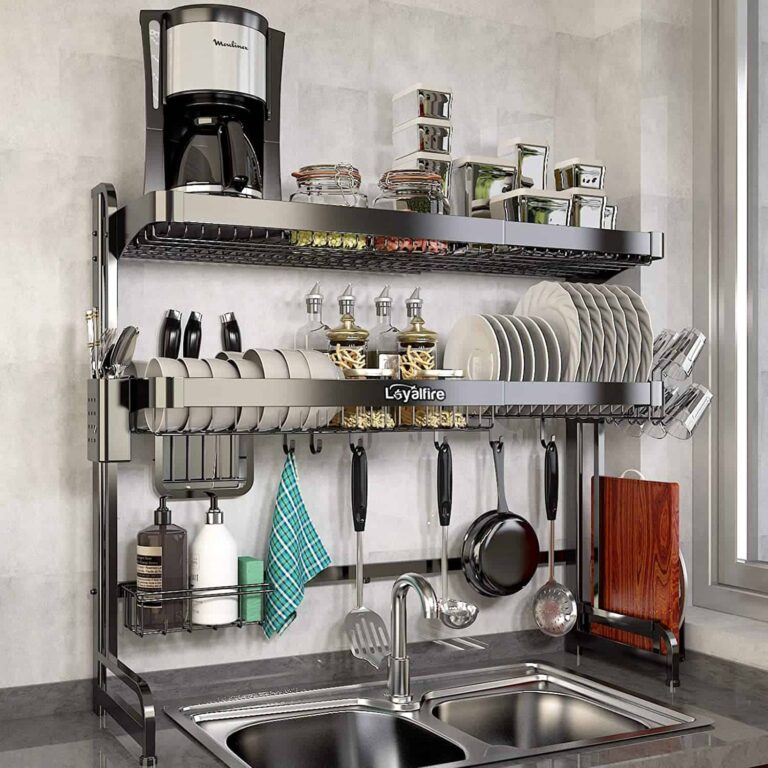
Find the location of a particular element. coffee pot is located at coordinates (203, 163).